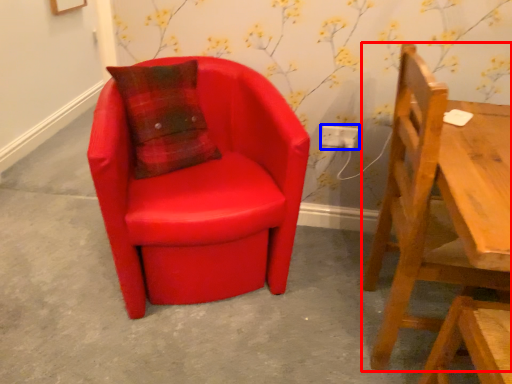
Question: Which point is closer to the camera, chair (highlighted by a red box) or electric outlet (highlighted by a blue box)?

Choices:
 (A) chair
 (B) electric outlet

Answer: (A)